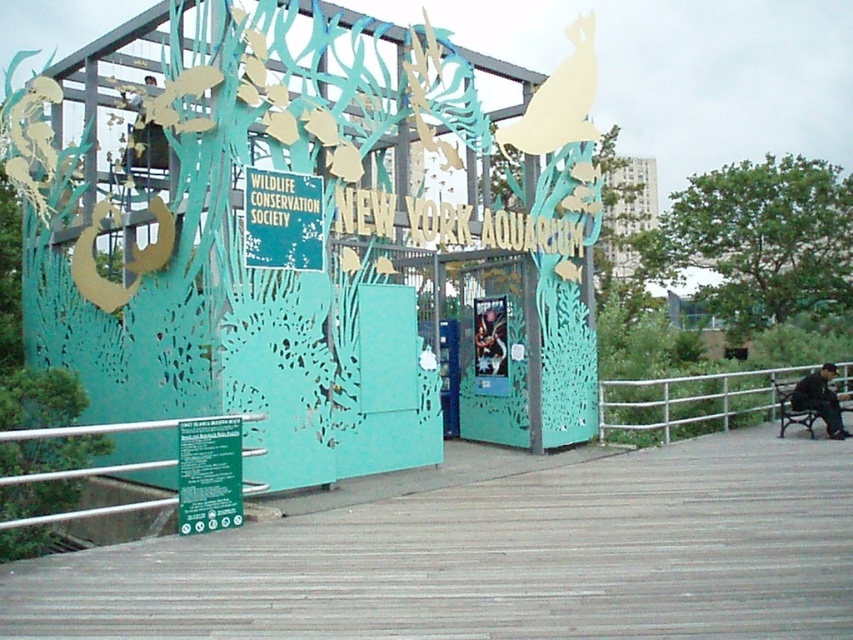
You are standing at the entrance of the New York Aquarium. You see the wooden planks at lower center marked by point (496,557). Where would you walk to reach the wooden planks at lower center?

The wooden planks at lower center marked by point (496,557) are located at the lower center of the entrance area, so you should walk forward towards the center of the entrance to reach them.

You are standing at the entrance of the New York Aquarium and want to walk towards the wooden planks at lower center. Which direction should you move relative to the white metal railing at lower right?

To reach the wooden planks at lower center, you should move towards the area below the white metal railing at lower right since the wooden planks at lower center is located below it.